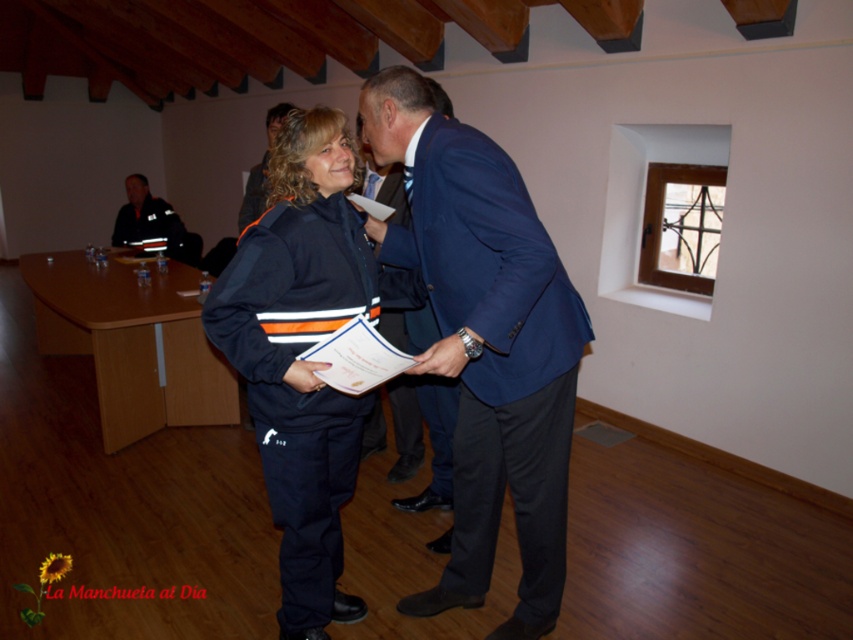
Can you confirm if navy blue uniform at center is smaller than navy blue jacket at center?

No.

Is navy blue uniform at center to the left of navy blue jacket at center from the viewer's perspective?

Incorrect, navy blue uniform at center is not on the left side of navy blue jacket at center.

Identify the location of navy blue uniform at center. (299, 353).

At what (x,y) coordinates should I click in order to perform the action: click on navy blue uniform at center. Please return your answer as a coordinate pair (x, y). Looking at the image, I should click on (299, 353).

Can you confirm if blue fabric suit at center is wider than reflective black uniform at upper left?

Incorrect, blue fabric suit at center's width does not surpass reflective black uniform at upper left's.

The width and height of the screenshot is (853, 640). In order to click on blue fabric suit at center in this screenshot , I will do `click(495, 364)`.

Which is behind, point (566, 316) or point (164, 212)?

Positioned behind is point (164, 212).

Find the location of a particular element. This screenshot has height=640, width=853. blue fabric suit at center is located at coordinates (495, 364).

Is matte blue jacket at center shorter than navy blue uniform at center?

No.

Is matte blue jacket at center above navy blue uniform at center?

Correct, matte blue jacket at center is located above navy blue uniform at center.

Is point (502, 486) farther from camera compared to point (273, 387)?

Yes, it is.

Where is `matte blue jacket at center`? matte blue jacket at center is located at coordinates (485, 342).